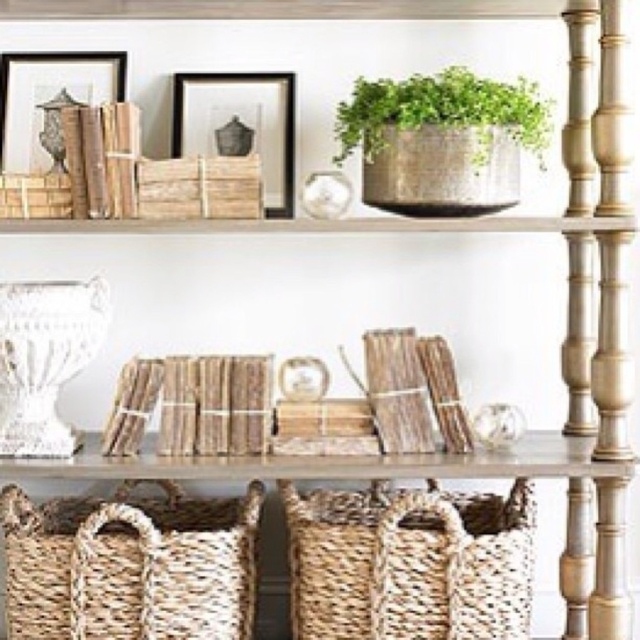
Question: Considering the relative positions of natural woven basket at lower left and rustic wicker basket at upper left in the image provided, where is natural woven basket at lower left located with respect to rustic wicker basket at upper left?

Choices:
 (A) left
 (B) right

Answer: (B)

Question: Which point appears farthest from the camera in this image?

Choices:
 (A) (461, 609)
 (B) (262, 116)
 (C) (22, 209)

Answer: (B)

Question: Which point is farther from the camera taking this photo?

Choices:
 (A) (364, 129)
 (B) (10, 202)
 (C) (400, 550)
 (D) (99, 99)

Answer: (D)

Question: Can you confirm if green woven basket at upper center is positioned to the left of matte black picture frame at upper center?

Choices:
 (A) no
 (B) yes

Answer: (A)

Question: Is woven natural basket at lower center bigger than matte black picture frame at upper center?

Choices:
 (A) yes
 (B) no

Answer: (A)

Question: Which point is farther from the camera taking this photo?

Choices:
 (A) (234, 141)
 (B) (328, 586)

Answer: (A)